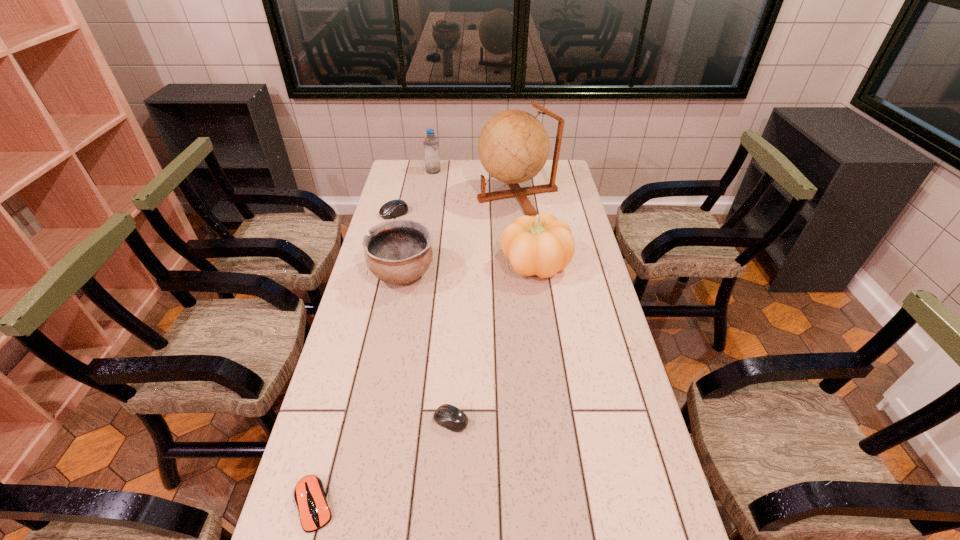
Locate an element on the screen. Image resolution: width=960 pixels, height=540 pixels. the tallest object is located at coordinates (513, 146).

This screenshot has height=540, width=960. Identify the location of blue water bottle. (431, 144).

Where is `pumpkin`? The image size is (960, 540). pumpkin is located at coordinates (542, 245).

Identify the location of the fourth tallest object. (398, 251).

Identify the location of the farther black mouse. The image size is (960, 540). (394, 208).

This screenshot has height=540, width=960. In order to click on the left black mouse in this screenshot , I will do `click(394, 208)`.

Locate an element on the screen. the smaller black mouse is located at coordinates (448, 416).

I want to click on the second shortest object, so click(x=448, y=416).

You are a GUI agent. You are given a task and a screenshot of the screen. Output one action in this format:
    pyautogui.click(x=<x>, y=<y>)
    Task: Click on the nearest computer mouse
    Image resolution: width=960 pixels, height=540 pixels.
    Given the screenshot: What is the action you would take?
    pyautogui.click(x=309, y=494)

What are the coordinates of `the nearest object` in the screenshot? It's located at (309, 494).